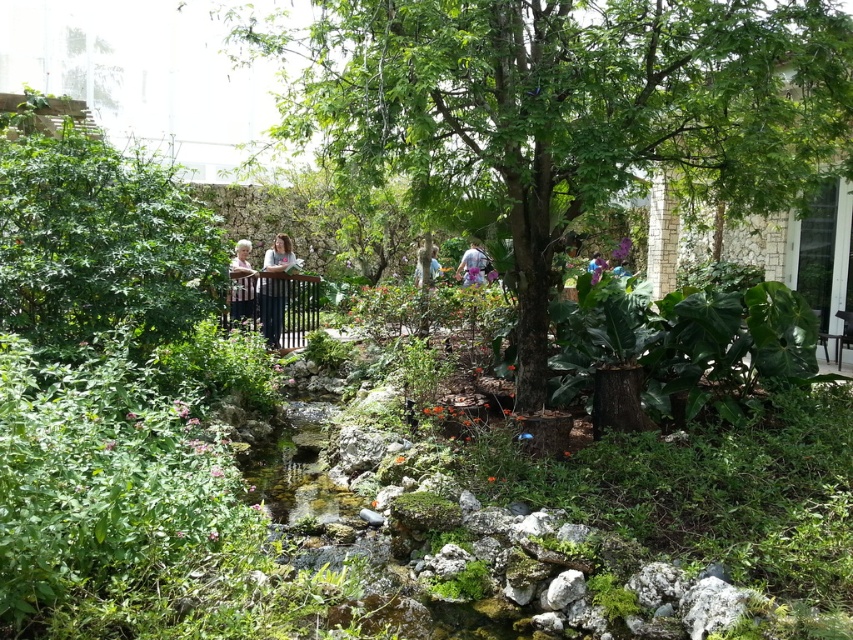
You are a photographer standing in the garden and want to capture both the green leafy tree at center and the light blue shirt at center in a single frame. Which object will appear bigger in the photo?

The green leafy tree at center will appear bigger in the photo because it is larger in size than the light blue shirt at center.

You are a visitor walking through the garden and see the black metal rail at center and the light blue denim jeans at center. Which object is located to the left of the other?

The black metal rail at center is positioned on the left side of light blue denim jeans at center.

You are a gardener planning to place a new decorative item between the black metal rail at center and the light blue denim jeans at center. Which object should you place closer to the stream to ensure the item fits without overlapping either object?

The light blue denim jeans at center is narrower than the black metal rail at center, so placing the decorative item closer to the light blue denim jeans at center would allow it to fit without overlapping either object.